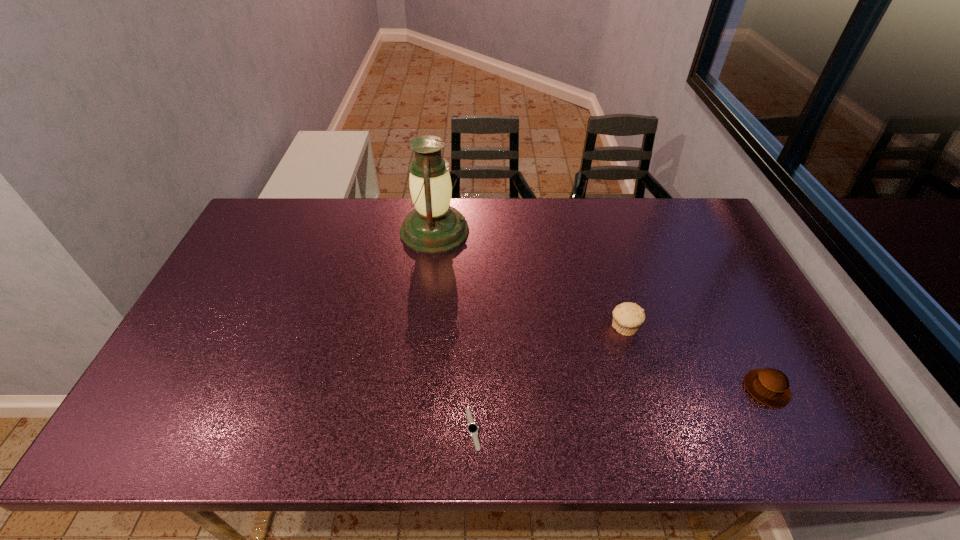
In order to click on free spot between the farthest object and the farther muffin in this screenshot , I will do `click(529, 279)`.

The image size is (960, 540). What are the coordinates of `unoccupied position between the watch and the right muffin` in the screenshot? It's located at 619,409.

I want to click on vacant area that lies between the taller muffin and the second shortest object, so click(x=695, y=358).

This screenshot has height=540, width=960. I want to click on vacant area that lies between the leftmost object and the taller muffin, so click(529, 279).

Image resolution: width=960 pixels, height=540 pixels. Find the location of `vacant area between the tallest object and the third object from left to right`. vacant area between the tallest object and the third object from left to right is located at coordinates pyautogui.click(x=529, y=279).

This screenshot has height=540, width=960. In order to click on blank region between the watch and the lantern in this screenshot , I will do `click(454, 330)`.

You are a GUI agent. You are given a task and a screenshot of the screen. Output one action in this format:
    pyautogui.click(x=<x>, y=<y>)
    Task: Click on the vacant area that lies between the second shortest object and the watch
    
    Given the screenshot: What is the action you would take?
    pyautogui.click(x=619, y=409)

This screenshot has width=960, height=540. I want to click on blank region between the third object from right to left and the taller muffin, so point(548,379).

The image size is (960, 540). What are the coordinates of `empty space between the right muffin and the left muffin` in the screenshot? It's located at (695, 358).

Choose which object is the second nearest neighbor to the taller muffin. Please provide its 2D coordinates. Your answer should be formatted as a tuple, i.e. [(x, y)], where the tuple contains the x and y coordinates of a point satisfying the conditions above.

[(472, 428)]